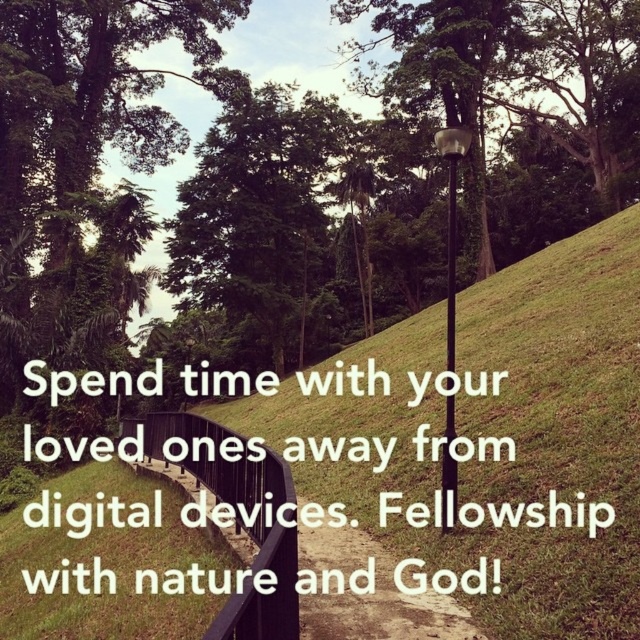
In the scene shown: You are a hiker standing at the start of the trail and want to reach the metallic pole at center. Which direction should you walk to get there from the black metal path at center?

The metallic pole at center is further away from the viewer than the black metal path at center. To reach the metallic pole at center, you should walk forward along the path away from the black metal path at center.

You are standing at the starting point of the black metal path at center. What are the coordinates of your current position?

The coordinates of the black metal path at center are at point [372,596].